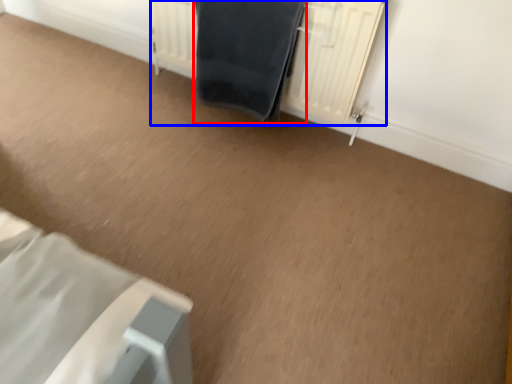
Question: Which point is further to the camera, bath towel (highlighted by a red box) or radiator (highlighted by a blue box)?

Choices:
 (A) bath towel
 (B) radiator

Answer: (A)